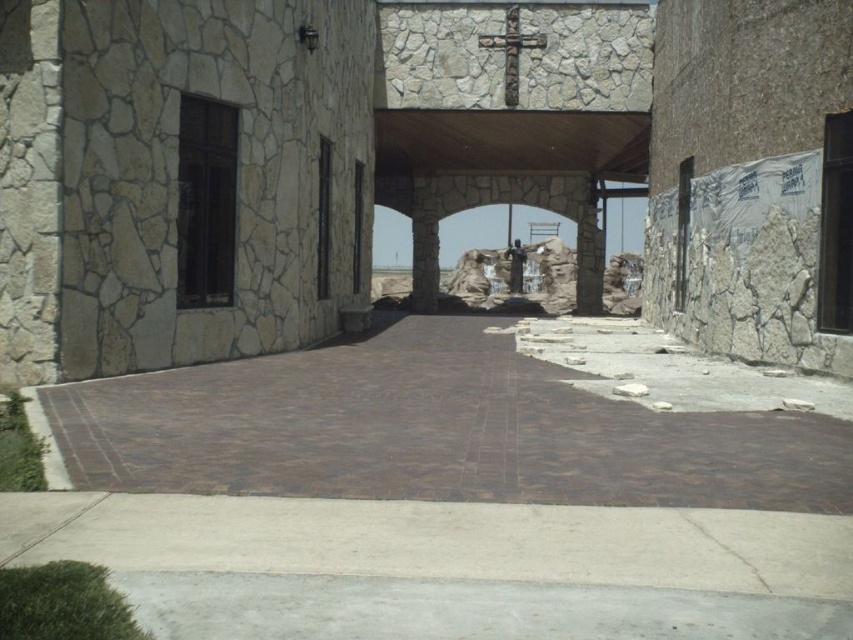
Question: Is brown stone pillar at center bigger than black stone door at center?

Choices:
 (A) yes
 (B) no

Answer: (A)

Question: Observing the image, what is the correct spatial positioning of clear glass door at left in reference to black stone door at center?

Choices:
 (A) right
 (B) left

Answer: (B)

Question: Which object appears closest to the camera in this image?

Choices:
 (A) brown stone pillar at center
 (B) black glass door at right
 (C) stone textured column at center
 (D) clear glass door at left

Answer: (B)

Question: Does black glass door at right lie in front of stone textured column at center?

Choices:
 (A) no
 (B) yes

Answer: (B)

Question: Which point appears farthest from the camera in this image?

Choices:
 (A) (575, 308)
 (B) (225, 26)

Answer: (A)

Question: Among these objects, which one is farthest from the camera?

Choices:
 (A) brown stone pillar at center
 (B) black glass door at right

Answer: (A)